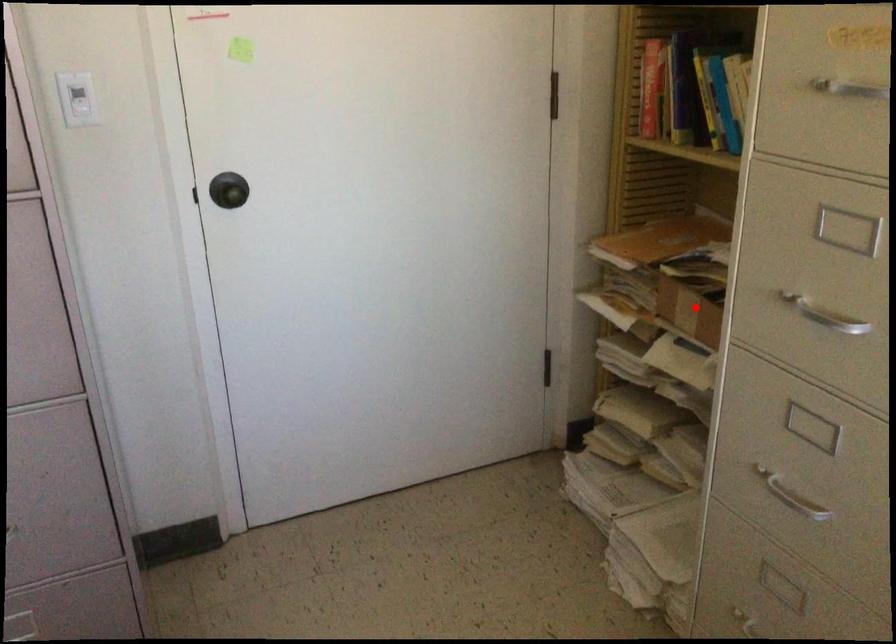
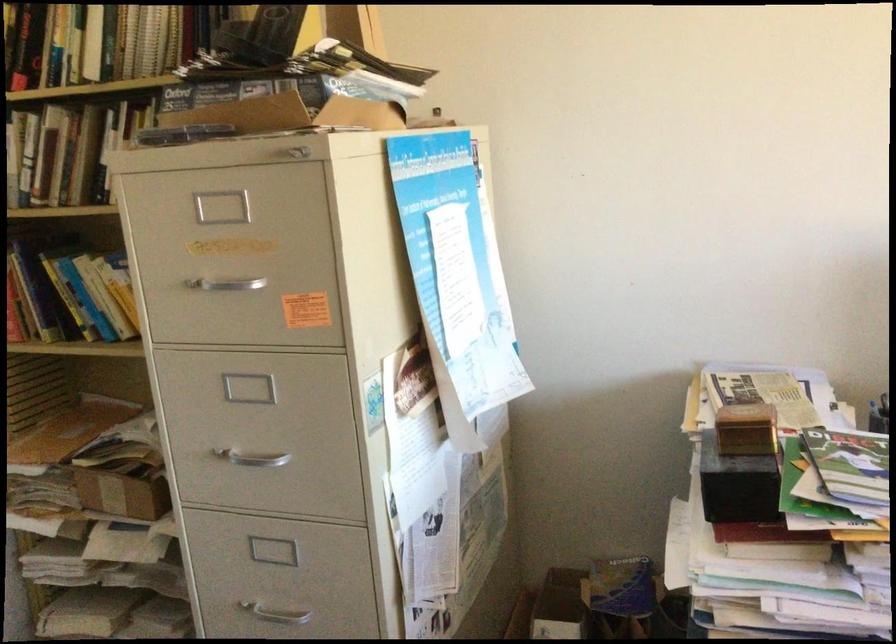
In the second image, find the point that corresponds to the highlighted location in the first image.

(123, 488)